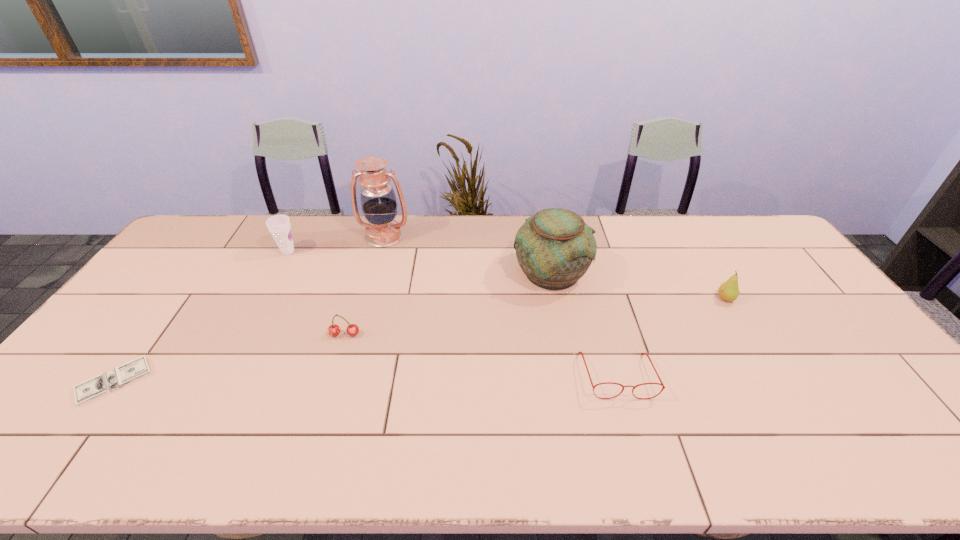
Locate an element on the screen. the tallest object is located at coordinates (378, 200).

The width and height of the screenshot is (960, 540). In order to click on pottery in this screenshot , I will do `click(554, 248)`.

At what (x,y) coordinates should I click in order to perform the action: click on the second object from left to right. Please return your answer as a coordinate pair (x, y). Image resolution: width=960 pixels, height=540 pixels. Looking at the image, I should click on (279, 226).

Where is `the fourth shortest object`? This screenshot has height=540, width=960. the fourth shortest object is located at coordinates (728, 291).

Where is `the rightmost object`? the rightmost object is located at coordinates (728, 291).

Image resolution: width=960 pixels, height=540 pixels. I want to click on cherry, so click(x=333, y=330).

Identify the location of the third shortest object. The height and width of the screenshot is (540, 960). (333, 330).

Where is `spectacles`? This screenshot has width=960, height=540. spectacles is located at coordinates (581, 353).

At what (x,y) coordinates should I click in order to perform the action: click on the shortest object. Please return your answer as a coordinate pair (x, y). This screenshot has height=540, width=960. Looking at the image, I should click on (105, 383).

Where is `the leftmost object`? This screenshot has width=960, height=540. the leftmost object is located at coordinates (105, 383).